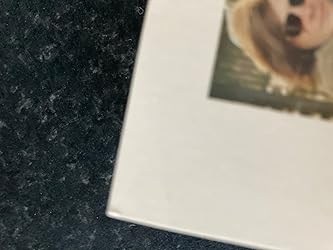
Locate an element on the screen. The image size is (333, 250). picture/photo is located at coordinates (225, 85).